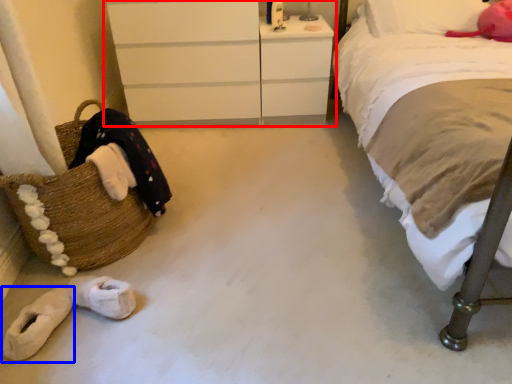
Question: Which of the following is the farthest to the observer, chest of drawers (highlighted by a red box) or footwear (highlighted by a blue box)?

Choices:
 (A) chest of drawers
 (B) footwear

Answer: (A)